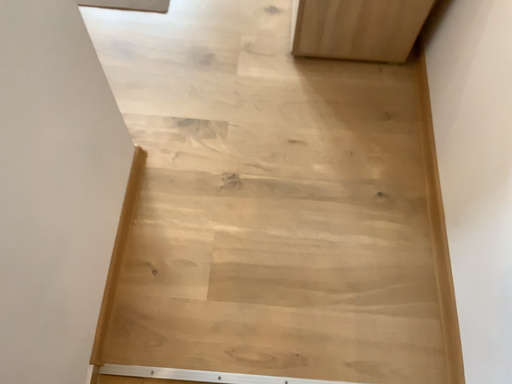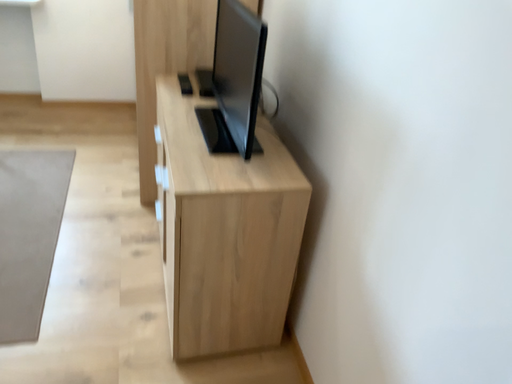
Question: How did the camera likely rotate when shooting the video?

Choices:
 (A) rotated left
 (B) rotated right

Answer: (B)